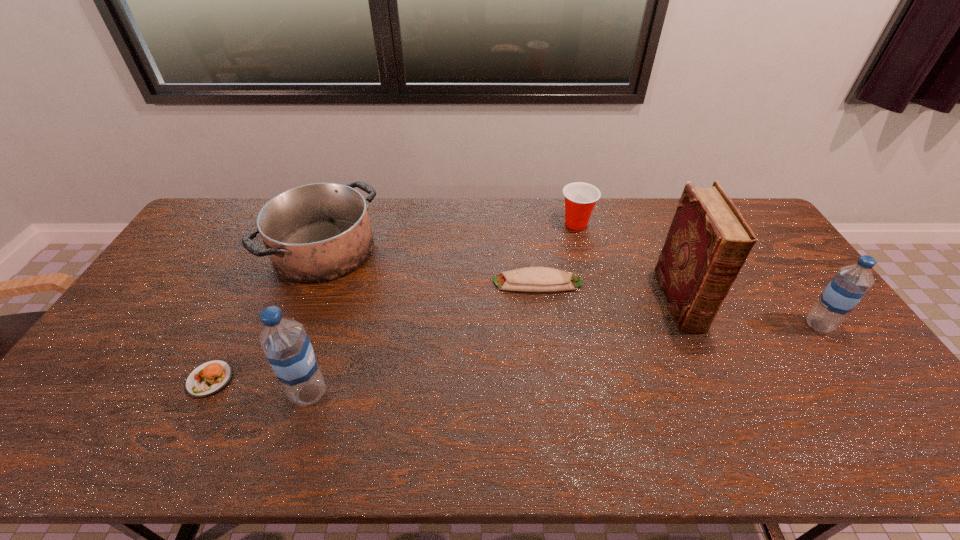
Find the location of `free space located 0.060m on the back of the saucepan`. free space located 0.060m on the back of the saucepan is located at coordinates pyautogui.click(x=341, y=207).

Find the location of a particular element. vacant region located 0.400m on the right of the third shortest object is located at coordinates (705, 224).

I want to click on vacant area situated 0.220m on the spine side of the hardback book, so click(728, 406).

At what (x,y) coordinates should I click in order to perform the action: click on free space located at the bitten end of the burrito. Please return your answer as a coordinate pair (x, y). Image resolution: width=960 pixels, height=540 pixels. Looking at the image, I should click on (425, 282).

Find the location of a particular element. This screenshot has width=960, height=540. blank space located 0.360m at the bitten end of the burrito is located at coordinates (377, 282).

Locate an element on the screen. Image resolution: width=960 pixels, height=540 pixels. vacant space located at the bitten end of the burrito is located at coordinates click(x=420, y=282).

Locate an element on the screen. Image resolution: width=960 pixels, height=540 pixels. free space located 0.210m on the right of the patty is located at coordinates [314, 379].

The height and width of the screenshot is (540, 960). Identify the location of saucepan that is at the far edge. (314, 233).

Where is `cup that is at the far edge`? cup that is at the far edge is located at coordinates (580, 198).

I want to click on water bottle that is at the near edge, so click(288, 348).